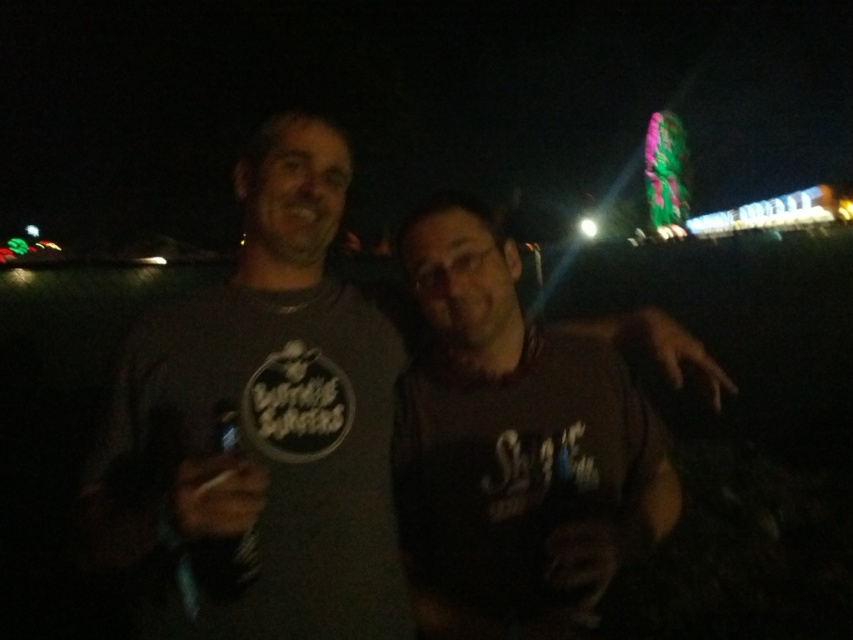
Can you confirm if dark gray t-shirt at center is smaller than dark brown fabric shirt at center?

Incorrect, dark gray t-shirt at center is not smaller in size than dark brown fabric shirt at center.

Between dark gray t-shirt at center and dark brown fabric shirt at center, which one is positioned higher?

dark gray t-shirt at center is above.

Is point (254, 600) less distant than point (544, 412)?

Yes, it is.

Where is `dark gray t-shirt at center`? The height and width of the screenshot is (640, 853). dark gray t-shirt at center is located at coordinates (263, 419).